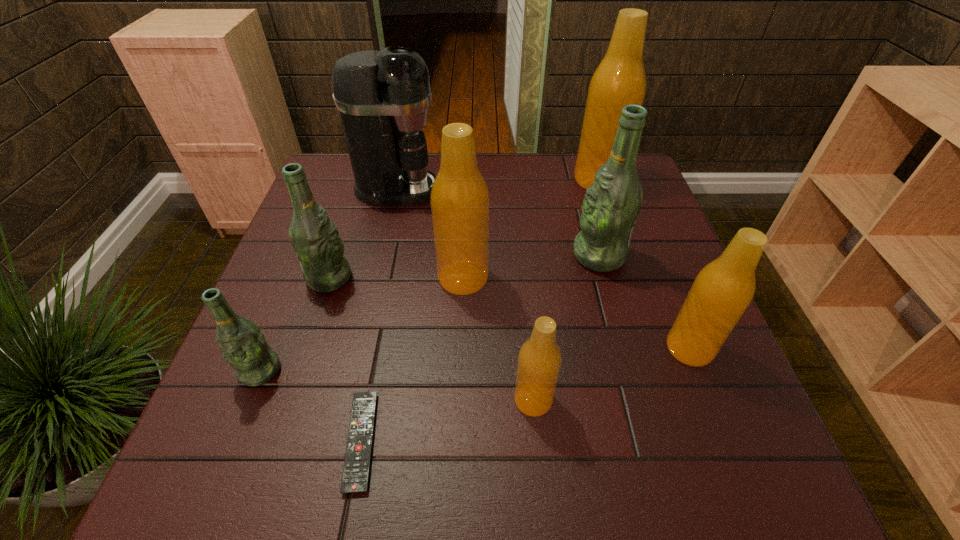
At what (x,y) coordinates should I click in order to perform the action: click on vacant area located on the left of the fourth beer bottle from left to right. Please return your answer as a coordinate pair (x, y). Image resolution: width=960 pixels, height=540 pixels. Looking at the image, I should click on (406, 400).

Locate an element on the screen. This screenshot has height=540, width=960. free location located 0.080m on the surface of the smallest green beer bottle is located at coordinates (237, 429).

Locate an element on the screen. This screenshot has width=960, height=540. vacant region located on the right of the remote control is located at coordinates (481, 441).

You are a GUI agent. You are given a task and a screenshot of the screen. Output one action in this format:
    pyautogui.click(x=<x>, y=<y>)
    Task: Click on the beer bottle situated at the far edge
    This screenshot has width=960, height=540.
    Given the screenshot: What is the action you would take?
    click(x=619, y=80)

You are a GUI agent. You are given a task and a screenshot of the screen. Output one action in this format:
    pyautogui.click(x=<x>, y=<y>)
    Task: Click on the coffee maker located at the far edge
    
    Given the screenshot: What is the action you would take?
    pyautogui.click(x=383, y=96)

Image resolution: width=960 pixels, height=540 pixels. I want to click on object that is at the near edge, so click(355, 476).

Locate an element on the screen. This screenshot has height=540, width=960. coffee maker positioned at the left edge is located at coordinates (383, 96).

Find the location of a particular element. The image size is (960, 540). object that is at the far left corner is located at coordinates (383, 96).

You are a GUI agent. You are given a task and a screenshot of the screen. Output one action in this format:
    pyautogui.click(x=<x>, y=<y>)
    Task: Click on the object present at the far right corner
    
    Given the screenshot: What is the action you would take?
    pyautogui.click(x=619, y=80)

You are a GUI agent. You are given a task and a screenshot of the screen. Output one action in this format:
    pyautogui.click(x=<x>, y=<y>)
    Task: Click on the free location at the far edge of the desktop
    
    Given the screenshot: What is the action you would take?
    click(570, 194)